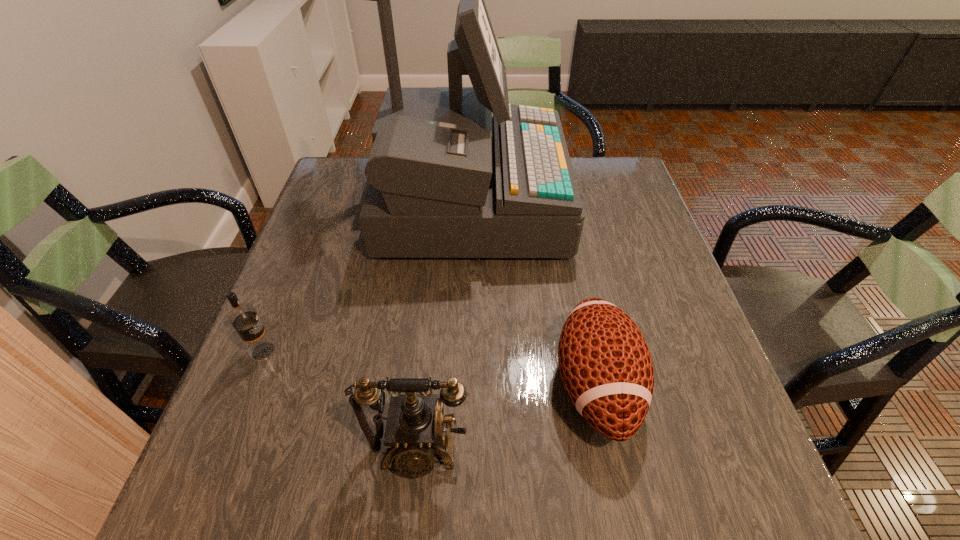
In order to click on empty location between the second tallest object and the tallest object in this screenshot , I will do `click(443, 325)`.

Identify the location of vacant point located between the third shortest object and the leftmost object. (340, 400).

Choose which object is the nearest neighbor to the cash register. Please provide its 2D coordinates. Your answer should be formatted as a tuple, i.e. [(x, y)], where the tuple contains the x and y coordinates of a point satisfying the conditions above.

[(605, 364)]

Identify which object is located as the nearest to the telephone. Please provide its 2D coordinates. Your answer should be formatted as a tuple, i.e. [(x, y)], where the tuple contains the x and y coordinates of a point satisfying the conditions above.

[(605, 364)]

You are a GUI agent. You are given a task and a screenshot of the screen. Output one action in this format:
    pyautogui.click(x=<x>, y=<y>)
    Task: Click on the free space that satisfies the following two spatial constraints: 1. on the customer-facing side of the tallest object; 2. on the rotary dial of the telephone
    This screenshot has height=540, width=960.
    Given the screenshot: What is the action you would take?
    pyautogui.click(x=461, y=448)

Identify the location of free location that satisfies the following two spatial constraints: 1. on the customer-facing side of the cash register; 2. on the right side of the football. The width and height of the screenshot is (960, 540). (463, 386).

At what (x,y) coordinates should I click in order to perform the action: click on free space that satisfies the following two spatial constraints: 1. on the customer-facing side of the cash register; 2. on the rotary dial of the telephone. Please return your answer as a coordinate pair (x, y). Looking at the image, I should click on tap(461, 448).

Where is `vacant space that satisfies the following two spatial constraints: 1. on the customer-facing side of the football; 2. on the left side of the cash register`? This screenshot has height=540, width=960. vacant space that satisfies the following two spatial constraints: 1. on the customer-facing side of the football; 2. on the left side of the cash register is located at coordinates (463, 386).

Identify the location of free spot that satisfies the following two spatial constraints: 1. on the label of the vodka; 2. on the back side of the football. The height and width of the screenshot is (540, 960). (250, 386).

The width and height of the screenshot is (960, 540). What are the coordinates of `free space that satisfies the following two spatial constraints: 1. on the back side of the football; 2. on the customer-facing side of the cash register` in the screenshot? It's located at (559, 202).